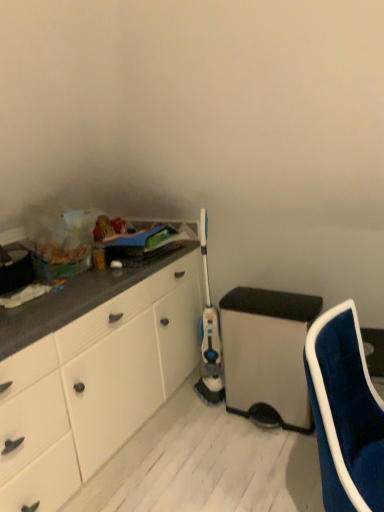
Question: Based on their positions, is matte plastic trash can at lower right located to the left or right of velvet blue chair at lower right?

Choices:
 (A) left
 (B) right

Answer: (A)

Question: From a real-world perspective, is matte plastic trash can at lower right physically located above or below velvet blue chair at lower right?

Choices:
 (A) above
 (B) below

Answer: (B)

Question: Considering the positions of point (284, 312) and point (337, 505), is point (284, 312) closer or farther from the camera than point (337, 505)?

Choices:
 (A) closer
 (B) farther

Answer: (B)

Question: Based on their sizes in the image, would you say velvet blue chair at lower right is bigger or smaller than matte plastic trash can at lower right?

Choices:
 (A) big
 (B) small

Answer: (A)

Question: Considering the relative positions of velvet blue chair at lower right and matte plastic trash can at lower right in the image provided, is velvet blue chair at lower right to the left or to the right of matte plastic trash can at lower right?

Choices:
 (A) left
 (B) right

Answer: (B)

Question: Relative to matte plastic trash can at lower right, is velvet blue chair at lower right in front or behind?

Choices:
 (A) front
 (B) behind

Answer: (A)

Question: Considering the positions of velvet blue chair at lower right and matte plastic trash can at lower right in the image, is velvet blue chair at lower right wider or thinner than matte plastic trash can at lower right?

Choices:
 (A) wide
 (B) thin

Answer: (B)